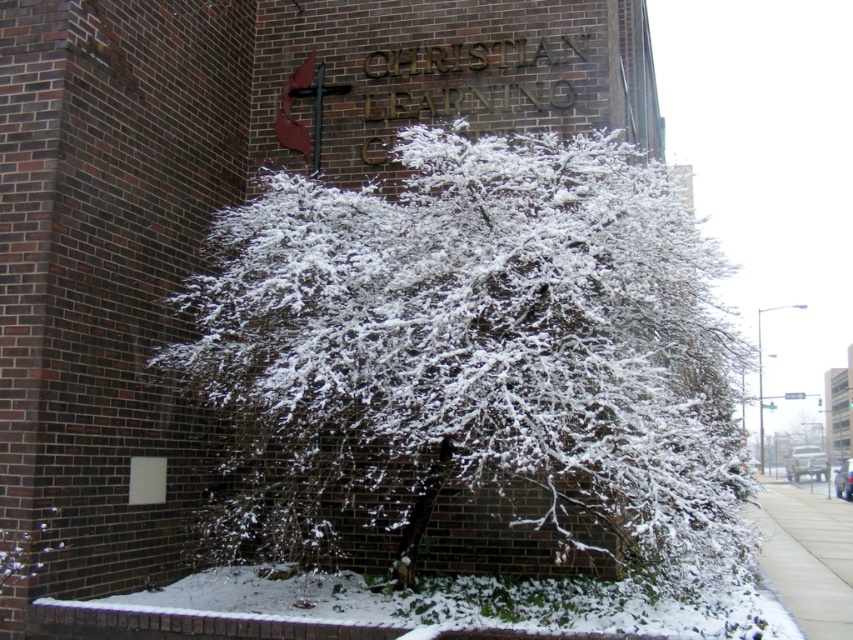
You are standing in front of the building and want to walk towards the point that is closer to you. Which point should you head towards, point (482,333) or point (846,611)?

You should head towards point (482,333) because it is closer to the viewer than point (846,611).